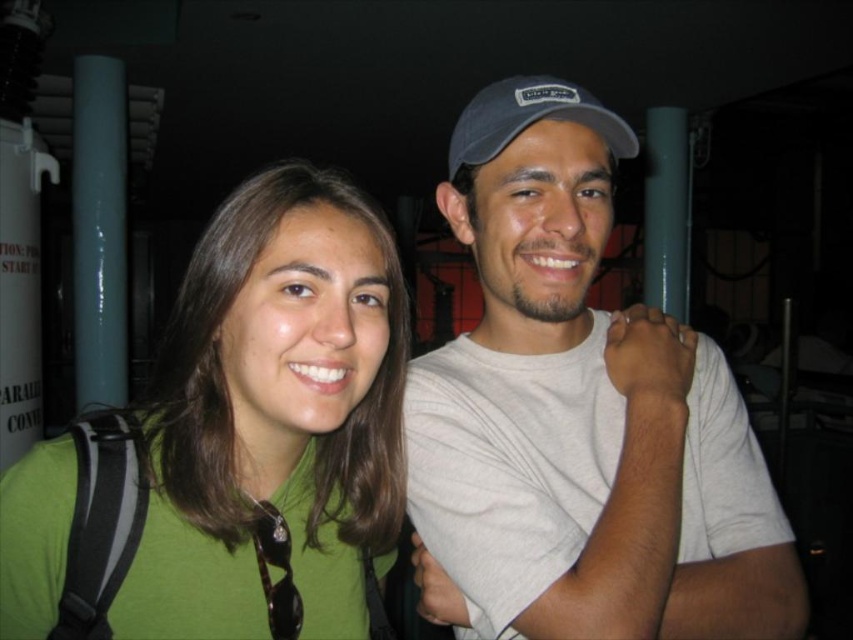
What are the coordinates of the green matte shirt at center?

The green matte shirt at center is located at point (274, 422).

You are a photographer setting up for a group photo. You want to ensure that the green matte shirt at center and the blue fabric baseball cap at upper center are both in focus. Given that your camera has a depth of field that can cover objects within 10 inches of each other, will both items be in focus?

The green matte shirt at center is 12.76 inches away from the blue fabric baseball cap at upper center. Since the distance between them exceeds the camera lens depth of field coverage of 10 inches, it is likely that both items cannot be in focus simultaneously. Adjust your camera settings or position to reduce the distance between them or increase the depth of field.